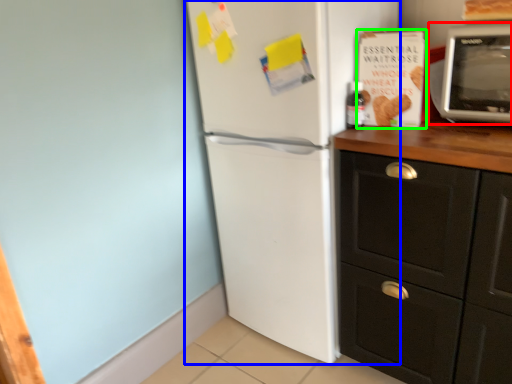
Question: Considering the real-world distances, which object is closest to microwave oven (highlighted by a red box)? refrigerator (highlighted by a blue box) or magazine (highlighted by a green box).

Choices:
 (A) refrigerator
 (B) magazine

Answer: (B)